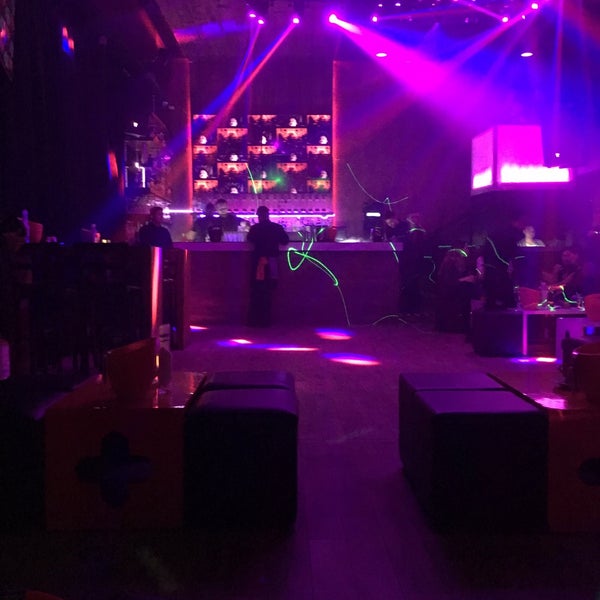
At what (x,y) coordinates should I click in order to perform the action: click on place to sit. Please return your answer as a coordinate pair (x, y). The height and width of the screenshot is (600, 600). Looking at the image, I should click on (233, 407), (461, 412), (431, 379), (272, 378).